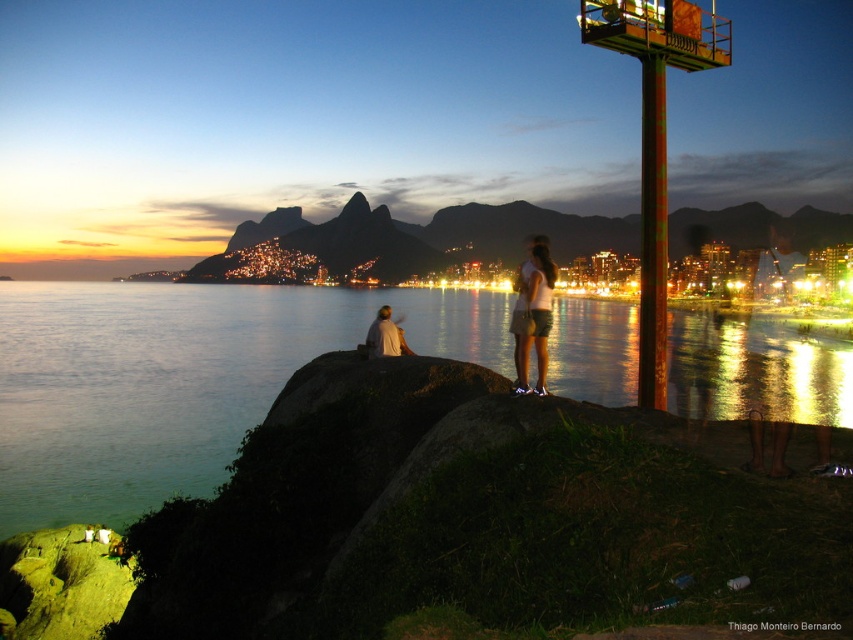
You are standing on the rocky outcrop and want to reach the white matte shorts at center without getting wet. The blue water at center is 127.94 meters away from the shorts. Can you safely walk from your current position to the shorts without entering the water?

The blue water at center is 127.94 meters away from the white matte shorts at center. Since the water is far away from the shorts, you can safely walk to the shorts without getting wet.

You are a photographer who wants to capture a photo of the blue water at center and the white matte shorts at center. Based on their sizes in the image, which one would appear larger in the final photo?

The blue water at center appears larger in the photo because it is much taller than the white matte shorts at center according to the description.

You are a photographer trying to capture the sunset at the coastal scene. You want to position yourself so that the white matte shorts at center are exactly in the center of your photo. Given the coordinates provided, where should you aim your camera?

The white matte shorts at center are already positioned at the center coordinates of the image, which is point (x=537, y=317). Therefore, aiming your camera at this point will ensure the white matte shorts at center are centered in your photo.